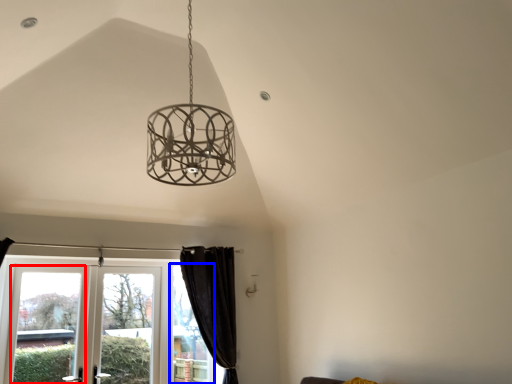
Question: Which of the following is the farthest to the observer, window (highlighted by a red box) or window (highlighted by a blue box)?

Choices:
 (A) window
 (B) window

Answer: (B)